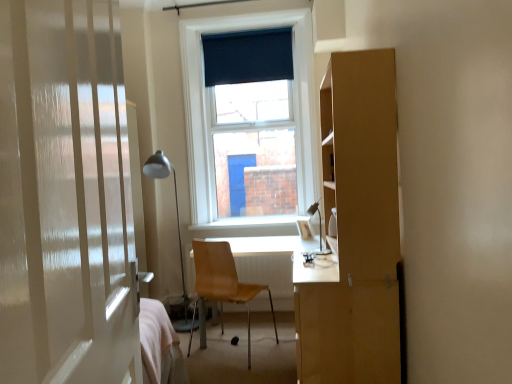
Question: Does dark blue fabric at upper center have a greater height compared to wooden chair at center?

Choices:
 (A) no
 (B) yes

Answer: (A)

Question: Is dark blue fabric at upper center facing towards wooden chair at center?

Choices:
 (A) yes
 (B) no

Answer: (B)

Question: Can you confirm if dark blue fabric at upper center is wider than wooden chair at center?

Choices:
 (A) no
 (B) yes

Answer: (A)

Question: From the image's perspective, is dark blue fabric at upper center located beneath wooden chair at center?

Choices:
 (A) no
 (B) yes

Answer: (A)

Question: Considering the relative positions of dark blue fabric at upper center and wooden chair at center in the image provided, is dark blue fabric at upper center in front of wooden chair at center?

Choices:
 (A) yes
 (B) no

Answer: (B)

Question: Is metallic silver table lamp at left, the 1th table lamp in the left-to-right sequence, bigger or smaller than white glossy door at left?

Choices:
 (A) big
 (B) small

Answer: (A)

Question: From the image's perspective, is metallic silver table lamp at left, acting as the 1th table lamp starting from the back, positioned above or below white glossy door at left?

Choices:
 (A) below
 (B) above

Answer: (A)

Question: From a real-world perspective, relative to white glossy door at left, is metallic silver table lamp at left, acting as the 1th table lamp starting from the back, vertically above or below?

Choices:
 (A) below
 (B) above

Answer: (A)

Question: Visually, is metallic silver table lamp at left, the 1th table lamp in the left-to-right sequence, positioned to the left or to the right of white glossy door at left?

Choices:
 (A) left
 (B) right

Answer: (A)

Question: Do you think light brown wooden desk at center is within matte silver table lamp at center, which appears as the 2th table lamp when viewed from the left, or outside of it?

Choices:
 (A) inside
 (B) outside

Answer: (B)

Question: Would you say light brown wooden desk at center is to the left or to the right of matte silver table lamp at center, which appears as the 2th table lamp when viewed from the left, in the picture?

Choices:
 (A) left
 (B) right

Answer: (A)

Question: Is point (243, 309) positioned closer to the camera than point (316, 206)?

Choices:
 (A) farther
 (B) closer

Answer: (A)

Question: From the image's perspective, is light brown wooden desk at center positioned above or below matte silver table lamp at center, which is counted as the first table lamp, starting from the front?

Choices:
 (A) above
 (B) below

Answer: (B)

Question: Considering the relative positions of matte silver table lamp at center, which is the first table lamp from right to left, and metallic silver table lamp at left, placed as the second table lamp when sorted from right to left, in the image provided, is matte silver table lamp at center, which is the first table lamp from right to left, to the left or to the right of metallic silver table lamp at left, placed as the second table lamp when sorted from right to left,?

Choices:
 (A) right
 (B) left

Answer: (A)

Question: Considering the positions of matte silver table lamp at center, which is counted as the first table lamp, starting from the front, and metallic silver table lamp at left, the 1th table lamp in the left-to-right sequence, in the image, is matte silver table lamp at center, which is counted as the first table lamp, starting from the front, taller or shorter than metallic silver table lamp at left, the 1th table lamp in the left-to-right sequence,?

Choices:
 (A) short
 (B) tall

Answer: (A)